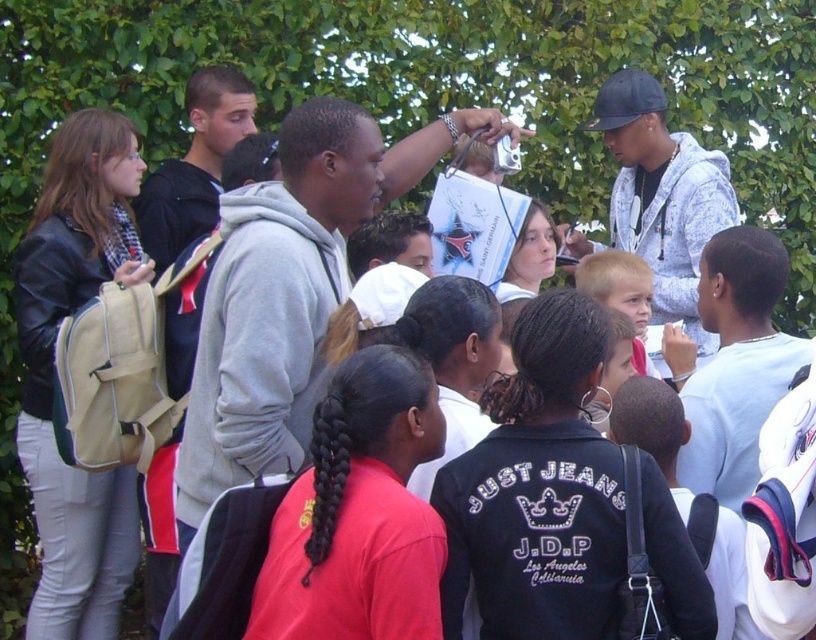
Is black leather jacket at center to the left of leather jacket at left from the viewer's perspective?

No, black leather jacket at center is not to the left of leather jacket at left.

Who is more forward, (506, 515) or (65, 474)?

Point (506, 515) is in front.

Does point (568, 504) come farther from viewer compared to point (114, 468)?

No, (568, 504) is in front of (114, 468).

The height and width of the screenshot is (640, 816). I want to click on black leather jacket at center, so pyautogui.click(x=539, y=490).